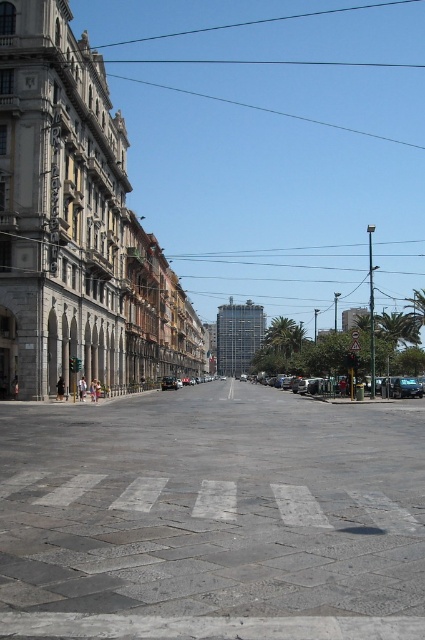
Question: Can you confirm if metallic reflective sign at center is positioned below metallic silver car at center?

Choices:
 (A) yes
 (B) no

Answer: (B)

Question: Is metallic reflective sign at center positioned behind metallic silver car at center?

Choices:
 (A) no
 (B) yes

Answer: (A)

Question: Which of the following is the closest to the observer?

Choices:
 (A) (353, 344)
 (B) (353, 426)
 (C) (422, 388)

Answer: (B)

Question: Estimate the real-world distances between objects in this image. Which object is farther from the metallic reflective sign at center?

Choices:
 (A) gray concrete plaza at center
 (B) metallic silver car at center

Answer: (B)

Question: Does metallic silver car at right have a larger size compared to metallic reflective sign at center?

Choices:
 (A) yes
 (B) no

Answer: (B)

Question: Which point is farther from the camera taking this photo?

Choices:
 (A) (399, 380)
 (B) (176, 589)
 (C) (164, 388)

Answer: (C)